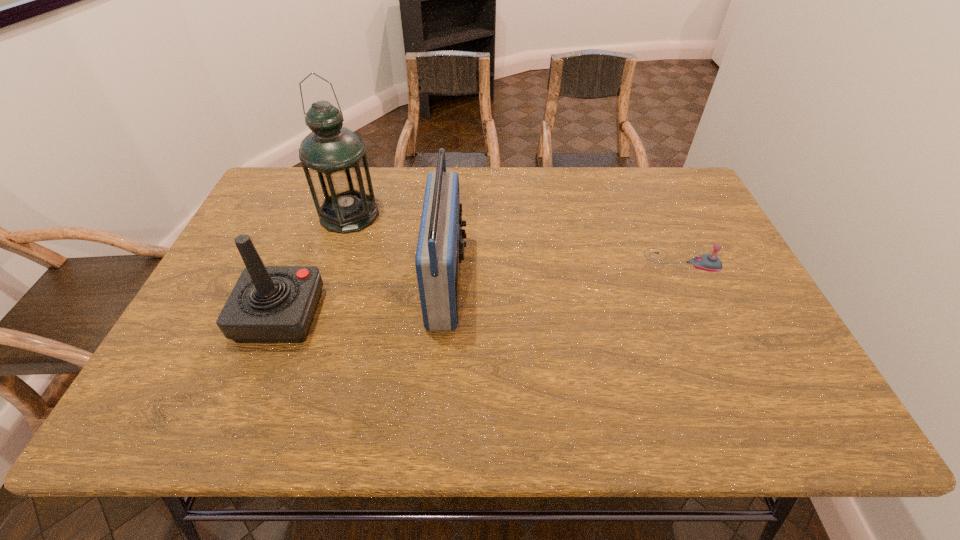
The height and width of the screenshot is (540, 960). Find the location of `vacant area between the nearer joystick and the tallest object`. vacant area between the nearer joystick and the tallest object is located at coordinates (315, 265).

The height and width of the screenshot is (540, 960). Identify the location of free space between the third object from left to right and the second shortest object. (364, 299).

Find the location of a particular element. The image size is (960, 540). blank region between the third tallest object and the second object from right to left is located at coordinates (364, 299).

Identify the location of free space between the right joystick and the left joystick. The image size is (960, 540). (481, 288).

Where is `free space between the farthest object and the radio receiver`? free space between the farthest object and the radio receiver is located at coordinates (398, 248).

You are a GUI agent. You are given a task and a screenshot of the screen. Output one action in this format:
    pyautogui.click(x=<x>, y=<y>)
    Task: Click on the empty space between the third object from left to right and the nearer joystick
    
    Given the screenshot: What is the action you would take?
    pyautogui.click(x=364, y=299)

The height and width of the screenshot is (540, 960). Identify the location of empty space that is in between the second object from right to left and the rightmost object. (564, 271).

You are a GUI agent. You are given a task and a screenshot of the screen. Output one action in this format:
    pyautogui.click(x=<x>, y=<y>)
    Task: Click on the empty space that is in between the shorter joystick and the second object from right to left
    
    Given the screenshot: What is the action you would take?
    pyautogui.click(x=564, y=271)

The height and width of the screenshot is (540, 960). In order to click on empty location between the farthest object and the radio receiver in this screenshot , I will do `click(398, 248)`.

Locate an element on the screen. This screenshot has width=960, height=540. vacant area that lies between the tallest object and the nearer joystick is located at coordinates (315, 265).